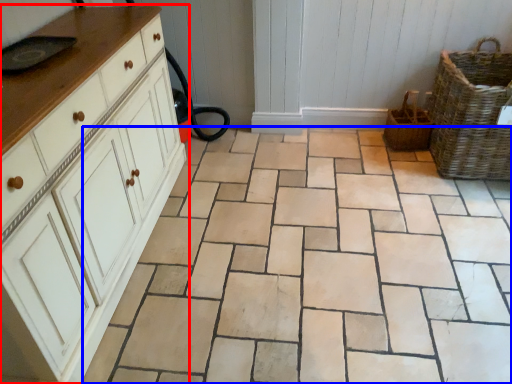
Question: Which of the following is the closest to the observer, chest of drawers (highlighted by a red box) or ceramic tile (highlighted by a blue box)?

Choices:
 (A) chest of drawers
 (B) ceramic tile

Answer: (A)